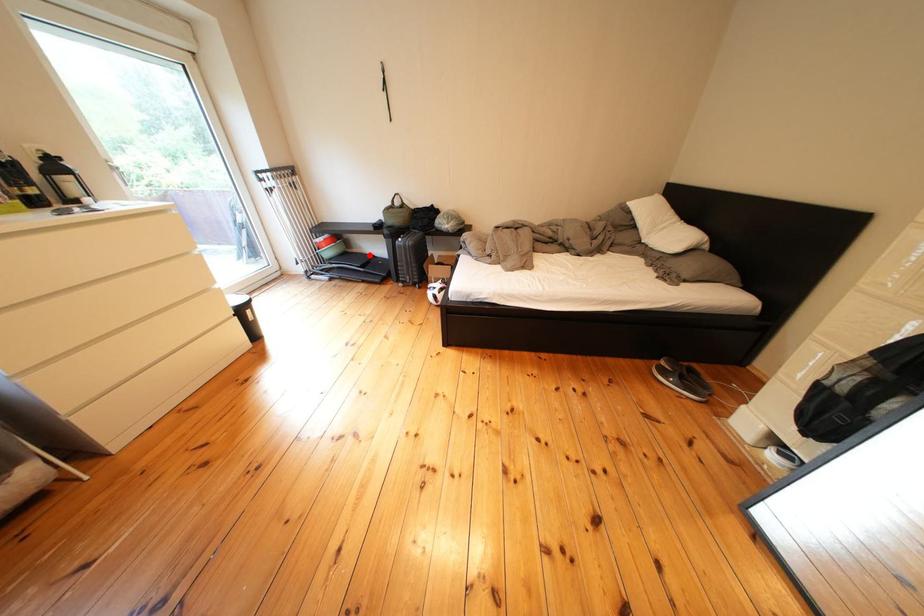
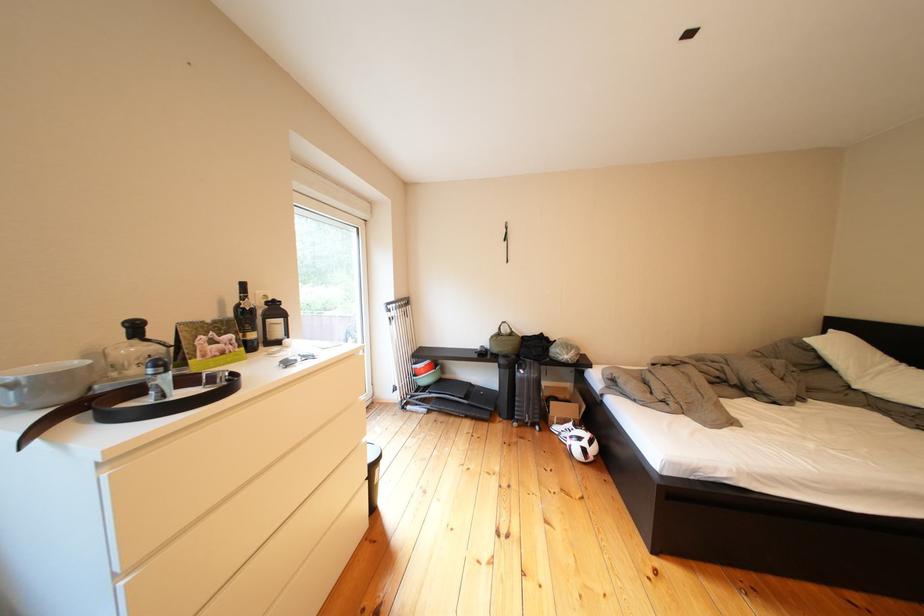
Where in the second image is the point corresponding to the highlighted location from the first image?

(462, 381)